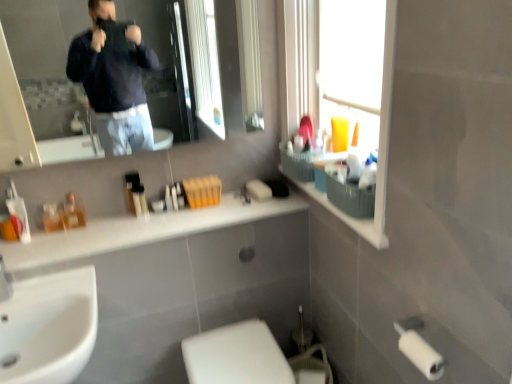
Where is `free spot above white glossy toilet at lower center (from a real-world perspective)`? The height and width of the screenshot is (384, 512). free spot above white glossy toilet at lower center (from a real-world perspective) is located at coordinates (237, 346).